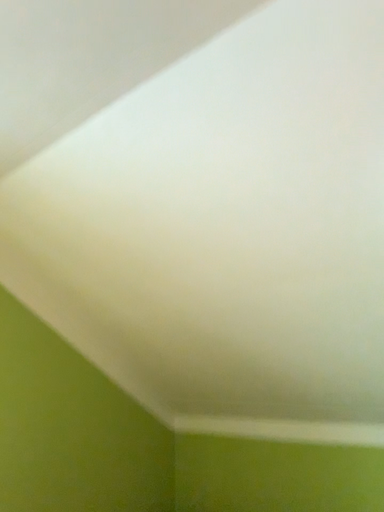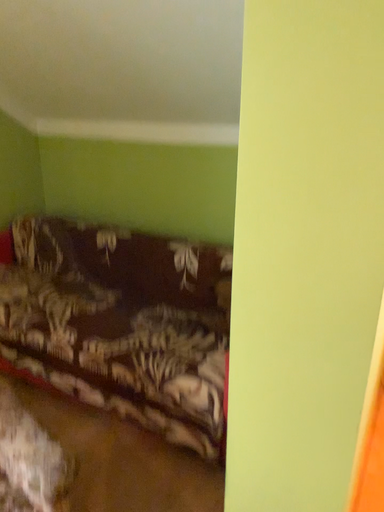
Question: How did the camera likely rotate when shooting the video?

Choices:
 (A) rotated left
 (B) rotated right

Answer: (B)